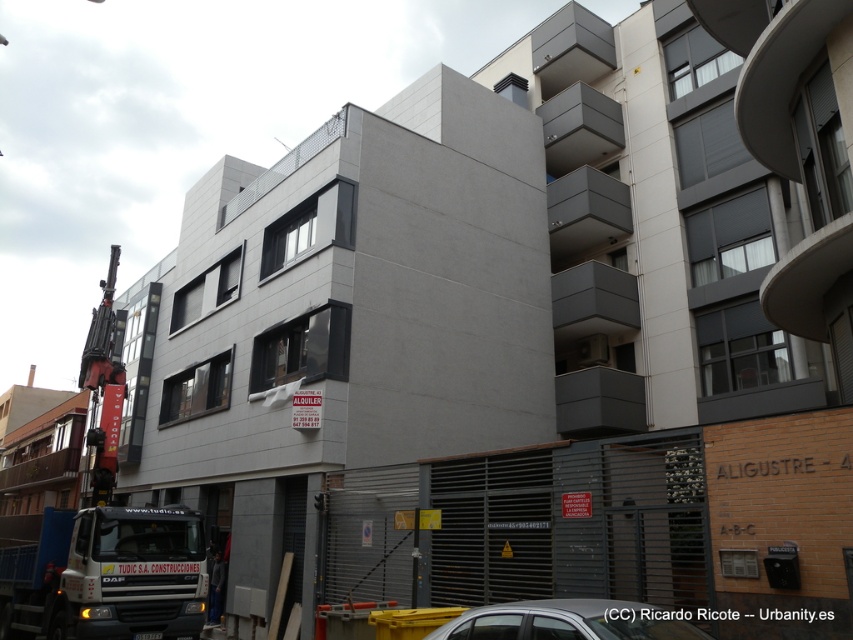
You are standing at the location of the viewer and want to cross the street to reach the construction crane in the image. The road has a speed limit of 30 km per hour. Is the metallic silver car at lower center blocking your path? If so, can you safely walk around it?

The metallic silver car at lower center is 4.18 meters away from the viewer. Since the car is in the lower center of the image, it is likely positioned directly in front of the viewer, blocking the path to the construction crane. To safely navigate around it, you would need to move either to the left or right of the car, ensuring that there is enough space to avoid traffic while adhering to the 30 km per hour speed limit. However, without knowing the exact dimensions of the car or the width of the road, it.

You are a delivery driver who needs to park your metallic silver car at lower center near the construction site. The parking area is marked at point coordinates (x=567, y=621). Can you safely park your car there?

Yes, the parking area at point coordinates (x=567, y=621) is exactly where the metallic silver car at lower center is located, so you can safely park there.